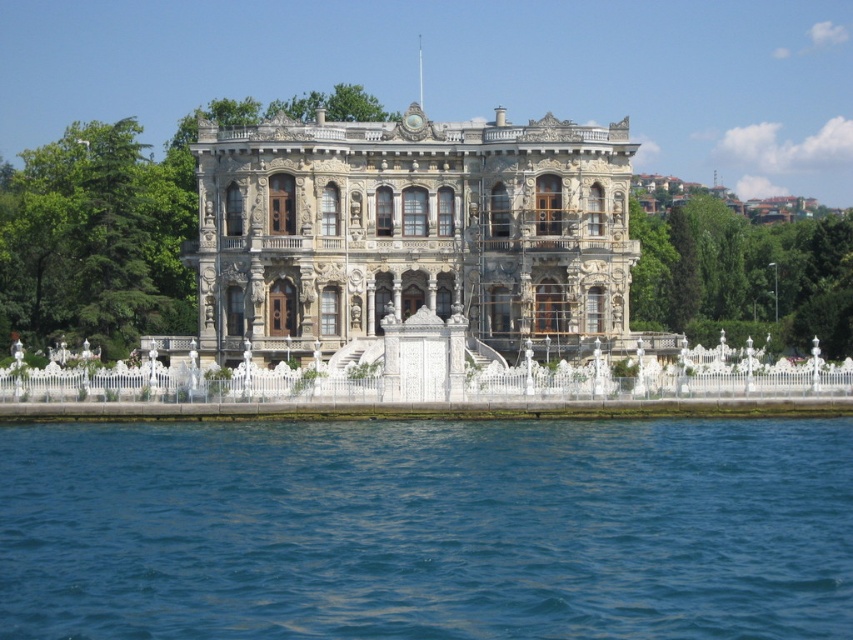
Which is in front, point (747, 604) or point (344, 301)?

Positioned in front is point (747, 604).

This screenshot has width=853, height=640. Describe the element at coordinates (427, 529) in the screenshot. I see `blue liquid water at lower center` at that location.

Where is `blue liquid water at lower center`? Image resolution: width=853 pixels, height=640 pixels. blue liquid water at lower center is located at coordinates (427, 529).